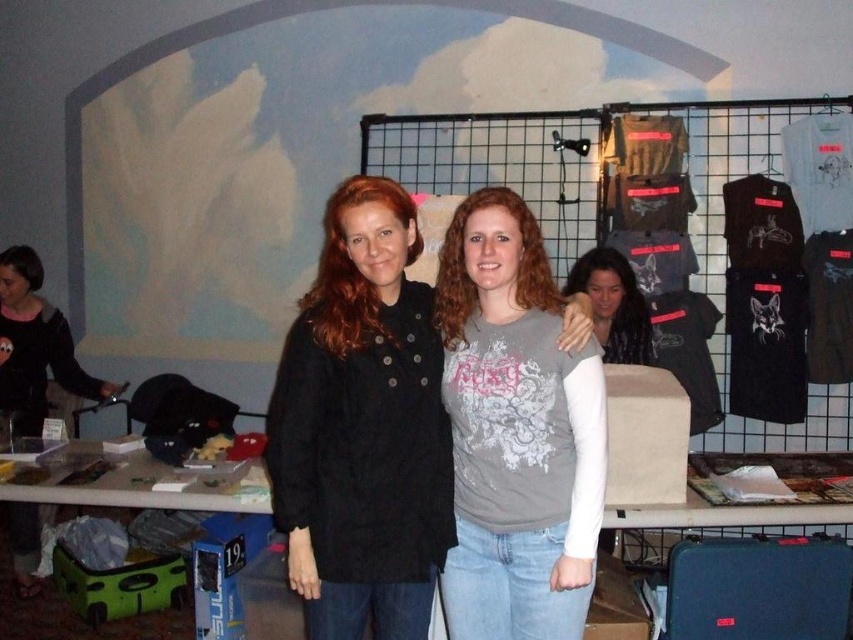
You are taking a photo of the gray matte shirt at center and the black matte jacket at left. Which one will appear larger in the photo?

The gray matte shirt at center will appear larger in the photo because it is closer to the viewer than the black matte jacket at left.

You are trying to determine which clothing item is taller between the gray matte shirt at center and the black matte jacket at left. Based on the scene, which one is taller?

The gray matte shirt at center is much taller than the black matte jacket at left according to the description.

You are trying to decide which matte black jacket to try on. You see the matte black jacket at center and the black matte jacket at left. Which one has a larger width?

The matte black jacket at center has a larger width than the black matte jacket at left.